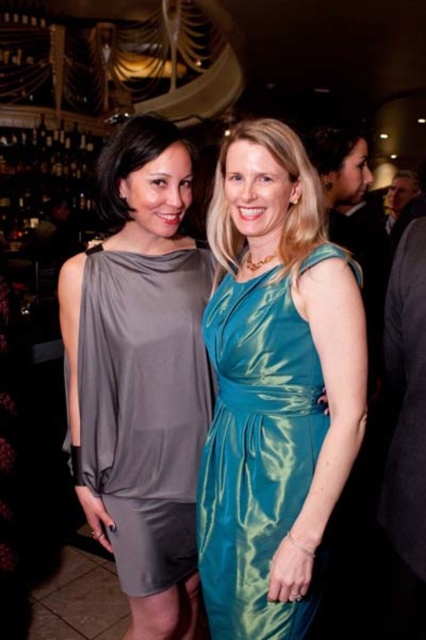
Question: Among these points, which one is farthest from the camera?

Choices:
 (A) (178, 323)
 (B) (207, 529)

Answer: (A)

Question: Among these objects, which one is nearest to the camera?

Choices:
 (A) matte gray dress at center
 (B) teal satin dress at center

Answer: (B)

Question: Can you confirm if matte gray dress at center is positioned below teal satin dress at center?

Choices:
 (A) no
 (B) yes

Answer: (A)

Question: Does matte gray dress at center have a larger size compared to teal satin dress at center?

Choices:
 (A) no
 (B) yes

Answer: (A)

Question: Does matte gray dress at center appear under teal satin dress at center?

Choices:
 (A) yes
 (B) no

Answer: (B)